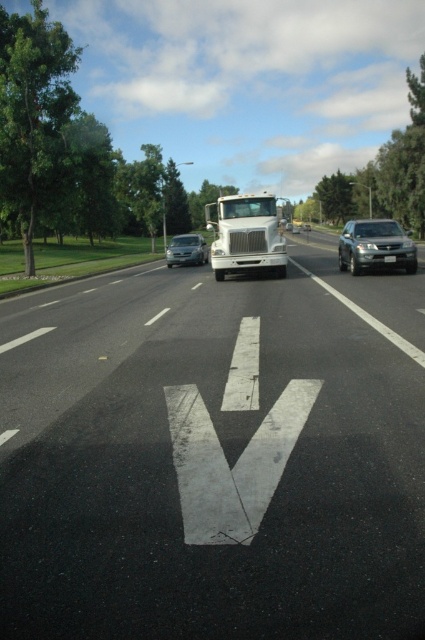
You are a pedestrian standing at the center of the road where the white V is painted. You see two points marked on the road ahead of you. Which point is closer to you, point (135, 336) or point (356, 228)?

Point (135, 336) is closer to the viewer than point (356, 228).

Looking at this image, you are standing on the side of the road and see the white matte truck at center approaching you. If you need to cross the road safely before the truck arrives, how much time do you have?

The white matte truck at center is 19.74 meters away from the viewer. To determine safe crossing time, consider your walking speed and the truck speed. If an average walking speed is 1.4 m per second, and assuming the truck is moving at 20 m per second, the time until it reaches you would be 19.74 divided by 20 equals approximately 0.987 seconds. This is too short for safe crossing, so do not attempt to cross.

You are a pedestrian standing on the sidewalk next to the road. You see the white asphalt road at center and the satin silver suv at right. Which object is closer to your left side?

The white asphalt road at center is to the left of the satin silver suv at right, so it is closer to your left side.